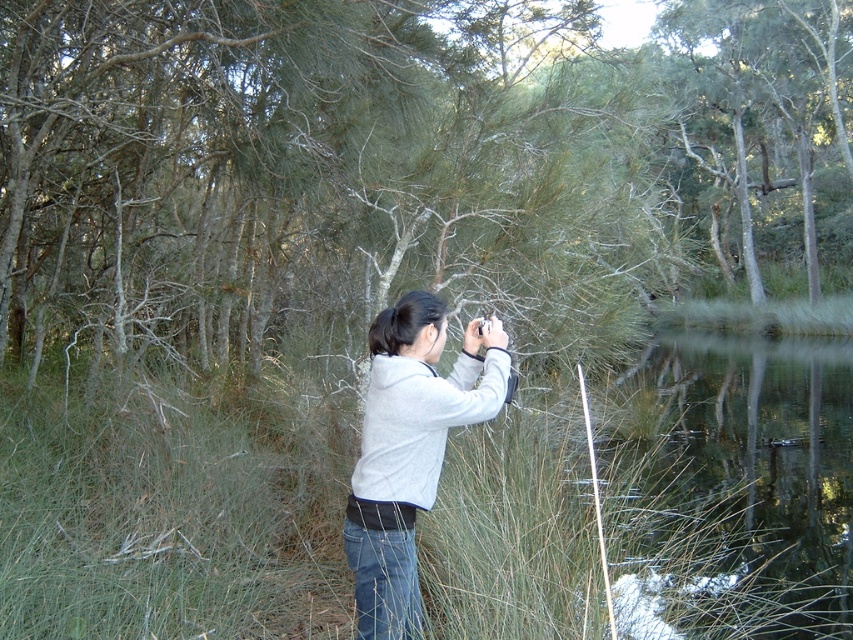
You are a photographer trying to capture the reflection of the trees in the clear water at lower right. Based on the scene description, where exactly should you position your camera to ensure the reflection is visible in the shot?

The clear water at lower right is located at point coordinates of (728, 486). Position your camera at that point to capture the reflection of the trees in the clear water at lower right.

In the scene shown: You are a photographer wanting to capture the green grass at center and clear water at lower right in a single frame. Based on their widths, which one will occupy more space horizontally in the photo?

The green grass at center will occupy more space horizontally in the photo because its width surpasses that of the clear water at lower right.